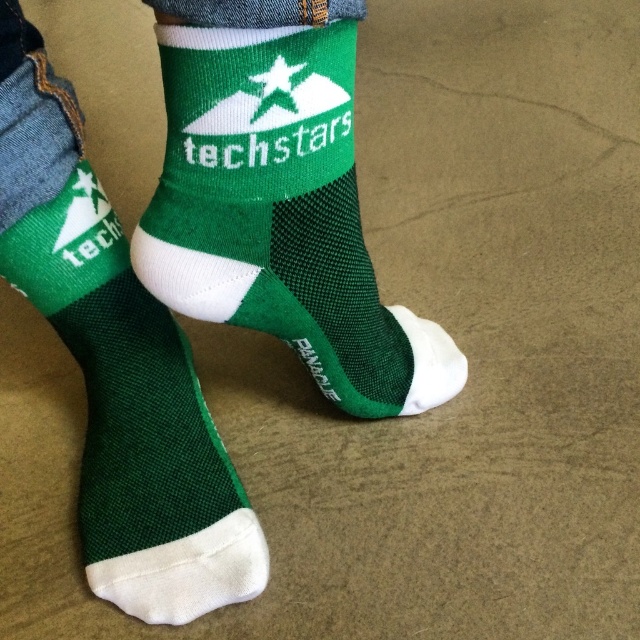
Question: Can you confirm if green knitted sock at center is positioned below green mesh sock at center?

Choices:
 (A) no
 (B) yes

Answer: (A)

Question: Is green mesh socks at center smaller than green mesh sock at center?

Choices:
 (A) no
 (B) yes

Answer: (A)

Question: Which object appears farthest from the camera in this image?

Choices:
 (A) green knitted sock at center
 (B) green mesh sock at lower left
 (C) green mesh socks at center
 (D) green mesh sock at center

Answer: (D)

Question: Can you confirm if green mesh sock at lower left is positioned below green mesh sock at center?

Choices:
 (A) no
 (B) yes

Answer: (B)

Question: Which point is closer to the camera taking this photo?

Choices:
 (A) (186, 580)
 (B) (179, 337)
 (C) (461, 356)

Answer: (A)

Question: Estimate the real-world distances between objects in this image. Which object is farther from the green mesh sock at lower left?

Choices:
 (A) green mesh socks at center
 (B) green mesh sock at center
 (C) green knitted sock at center

Answer: (B)